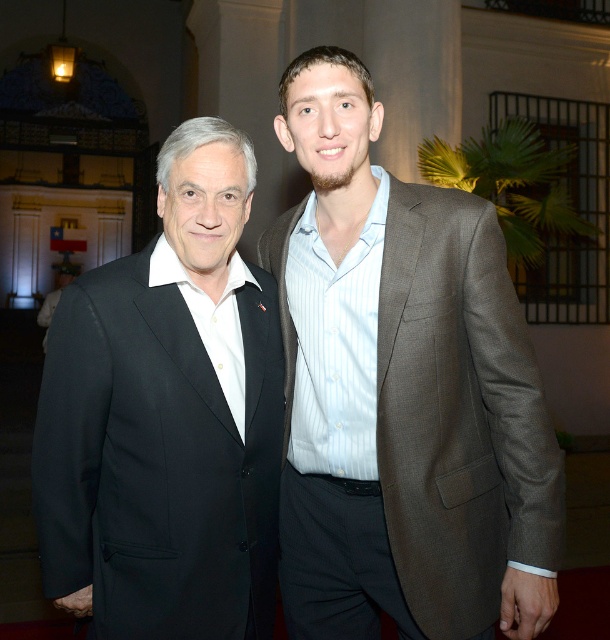
You are a photographer adjusting your camera settings. You want to focus on the brown textured suit at center and the black wool suit at left. Which of these suits is positioned closer to you?

The brown textured suit at center is closer to the viewer than the black wool suit at left.

You are standing in a formal event venue with two people in front of you. You need to reach a point that is exactly 2 meters away from your current position. Given the coordinates provided, can you determine if the point at point (417, 364) is within reach?

The point at point (417, 364) is 2.03 meters away from the viewer, so it is slightly out of reach since it is just over 2 meters away.